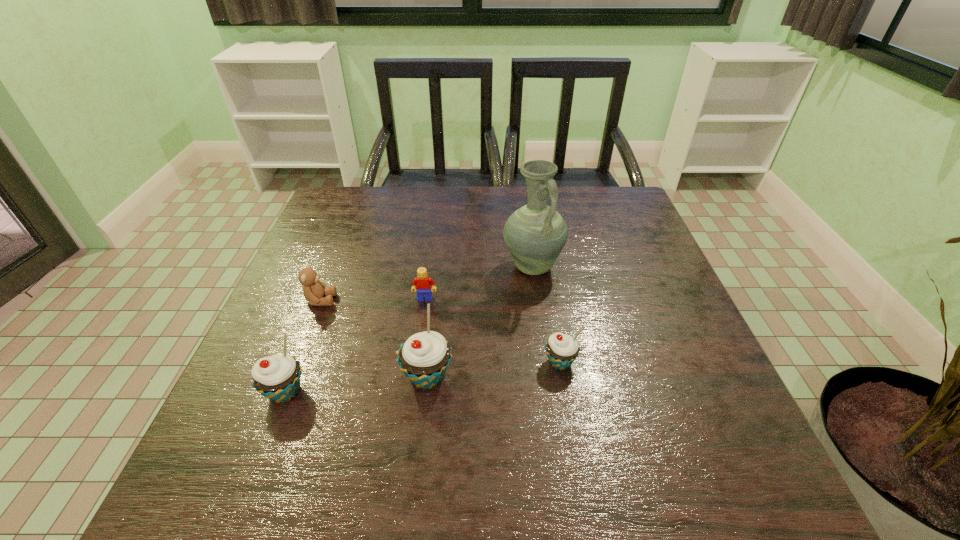
Observe the arrangement of all cupcakes in the image. To keep them evenly spaced, where would you place another cupcake on the right? Please locate a free space. Please provide its 2D coordinates. Your answer should be formatted as a tuple, i.e. [(x, y)], where the tuple contains the x and y coordinates of a point satisfying the conditions above.

[(685, 349)]